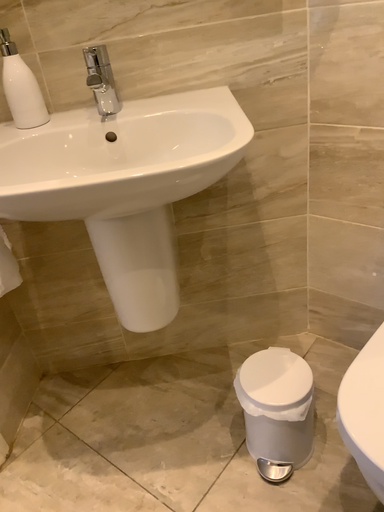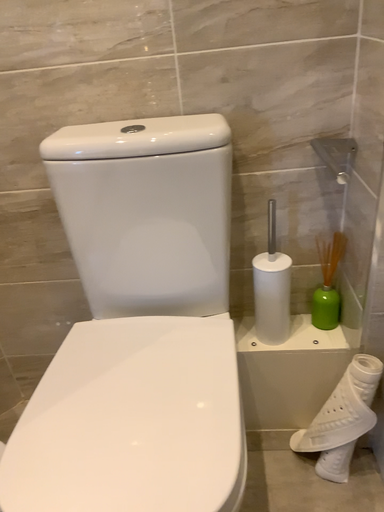
Question: Which way did the camera rotate in the video?

Choices:
 (A) rotated downward
 (B) rotated upward

Answer: (B)